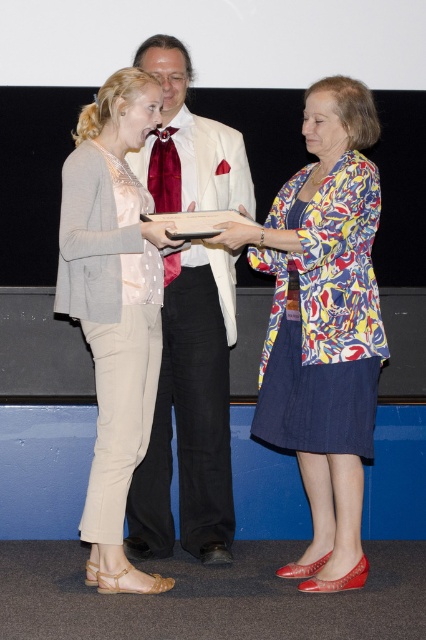
You are an event photographer at the ceremony. You need to capture a photo of the printed fabric jacket at center and the beige cotton pants at left. Based on their positions, which object should you focus on first to ensure both are in frame?

The printed fabric jacket at center is below the beige cotton pants at left, so you should focus on the beige cotton pants at left first to ensure both are in frame.

You are an event photographer at the ceremony. You need to capture a clear shot of both the printed fabric jacket at center and the matte white suit at center. Can you focus on both items at the same time?

The printed fabric jacket at center is above the matte white suit at center, so yes, you can focus on both items at the same time as they are vertically aligned.